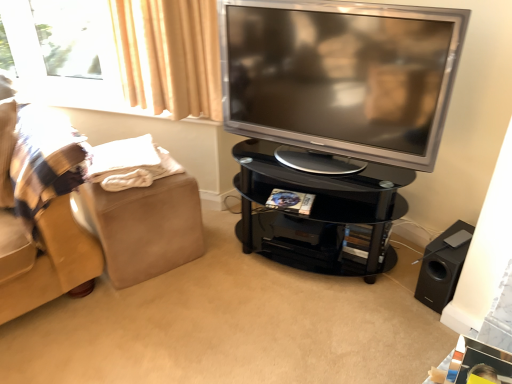
Where is `vacant space in between black matte speaker at lower right and black glass tv stand at center`? vacant space in between black matte speaker at lower right and black glass tv stand at center is located at coordinates 406,276.